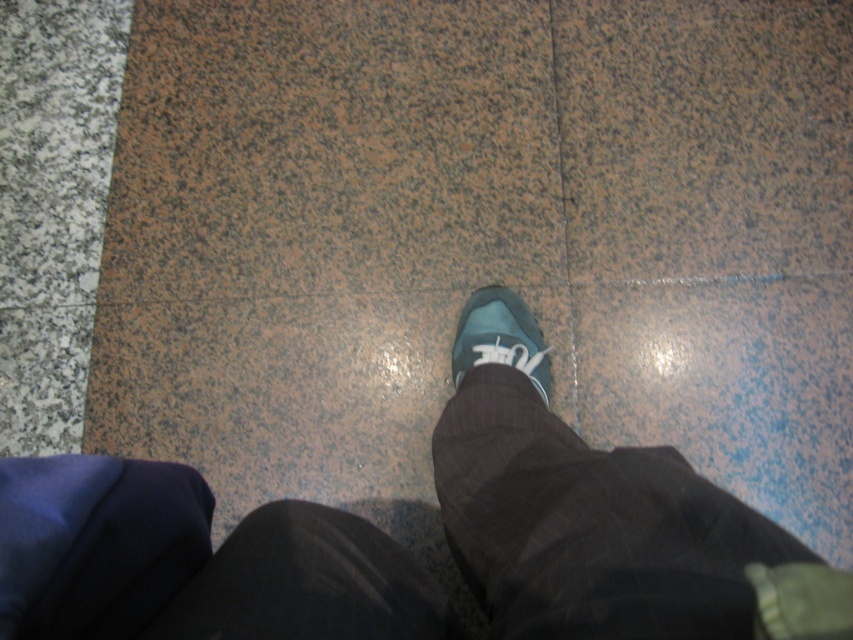
You are standing in a train station and see a person wearing dark pants and a pair of teal sneakers. There is a specific point marked at coordinates (611, 532). What object is located at that point?

The point at (611, 532) indicates the location of the matte blue shoe at center.

You are standing in a dimly lit indoor area with speckled brown, black, and gray tiles. You notice a matte blue shoe at center. Based on its position, can you determine if it is closer to the front or back of the person?

The matte blue shoe at center is located at point (611,532), which places it closer to the front of the person since the left foot is slightly forward compared to the right.

Consider the image. You are a security camera monitoring the scene. You notice two items labeled as matte blue shoe at center and matte blue sneaker at center. Which one is covering the other?

The matte blue shoe at center is positioned under the matte blue sneaker at center, so the sneaker is covering the shoe.